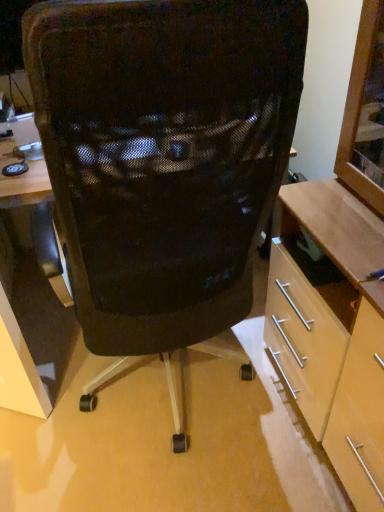
This screenshot has height=512, width=384. What do you see at coordinates (164, 157) in the screenshot?
I see `black mesh chair at center` at bounding box center [164, 157].

At what (x,y) coordinates should I click in order to perform the action: click on black mesh chair at center. Please return your answer as a coordinate pair (x, y). This screenshot has height=512, width=384. Looking at the image, I should click on (164, 157).

The image size is (384, 512). What do you see at coordinates (338, 287) in the screenshot?
I see `light wood cabinet at right` at bounding box center [338, 287].

Where is `light wood cabinet at right`? The width and height of the screenshot is (384, 512). light wood cabinet at right is located at coordinates point(338,287).

Find the location of a particular element. The image size is (384, 512). black mesh chair at center is located at coordinates (164, 157).

Is light wood cabinet at right at the left side of black mesh chair at center?

No, light wood cabinet at right is not to the left of black mesh chair at center.

Looking at this image, is the position of light wood cabinet at right more distant than that of black mesh chair at center?

No, it is not.

Is point (379, 250) less distant than point (55, 102)?

No, (379, 250) is behind (55, 102).

From the image's perspective, is light wood cabinet at right on black mesh chair at center?

Incorrect, from the image's perspective, light wood cabinet at right is lower than black mesh chair at center.

From a real-world perspective, between light wood cabinet at right and black mesh chair at center, who is vertically higher?

light wood cabinet at right, from a real-world perspective.

Considering the sizes of objects light wood cabinet at right and black mesh chair at center in the image provided, who is wider, light wood cabinet at right or black mesh chair at center?

black mesh chair at center.

Which of these two, light wood cabinet at right or black mesh chair at center, stands shorter?

light wood cabinet at right is shorter.

Based on the photo, does light wood cabinet at right have a larger size compared to black mesh chair at center?

Incorrect, light wood cabinet at right is not larger than black mesh chair at center.

Is black mesh chair at center located within light wood cabinet at right?

No, light wood cabinet at right does not contain black mesh chair at center.

Is light wood cabinet at right next to black mesh chair at center and touching it?

light wood cabinet at right and black mesh chair at center are clearly separated.

Is light wood cabinet at right looking in the opposite direction of black mesh chair at center?

No, black mesh chair at center is not at the back of light wood cabinet at right.

How many degrees apart are the facing directions of light wood cabinet at right and black mesh chair at center?

89.3 degrees.

Locate an element on the screen. This screenshot has width=384, height=512. chair on the left of the light wood cabinet at right is located at coordinates (164, 157).

Does black mesh chair at center appear on the left side of light wood cabinet at right?

Correct, you'll find black mesh chair at center to the left of light wood cabinet at right.

From the picture: Is black mesh chair at center in front of or behind light wood cabinet at right in the image?

black mesh chair at center is behind light wood cabinet at right.

Does point (201, 323) come farther from viewer compared to point (377, 38)?

Yes, it is behind point (377, 38).

From the image's perspective, does black mesh chair at center appear higher than light wood cabinet at right?

Correct, black mesh chair at center appears higher than light wood cabinet at right in the image.

From a real-world perspective, is black mesh chair at center below light wood cabinet at right?

Yes, from a real-world perspective, black mesh chair at center is beneath light wood cabinet at right.

Considering the sizes of objects black mesh chair at center and light wood cabinet at right in the image provided, who is wider, black mesh chair at center or light wood cabinet at right?

With larger width is black mesh chair at center.

Considering the sizes of objects black mesh chair at center and light wood cabinet at right in the image provided, who is shorter, black mesh chair at center or light wood cabinet at right?

With less height is light wood cabinet at right.

Is black mesh chair at center bigger or smaller than light wood cabinet at right?

black mesh chair at center is bigger than light wood cabinet at right.

Based on the photo, is black mesh chair at center spatially inside light wood cabinet at right, or outside of it?

black mesh chair at center cannot be found inside light wood cabinet at right.

Is black mesh chair at center next to light wood cabinet at right?

black mesh chair at center is not next to light wood cabinet at right, and they're not touching.

Could you tell me if black mesh chair at center is facing light wood cabinet at right?

No, black mesh chair at center is not turned towards light wood cabinet at right.

Can you tell me how much black mesh chair at center and light wood cabinet at right differ in facing direction?

The angle between the facing direction of black mesh chair at center and the facing direction of light wood cabinet at right is 89.3 degrees.

Locate an element on the screen. chair on the left of light wood cabinet at right is located at coordinates (164, 157).

This screenshot has height=512, width=384. I want to click on chair that is above the light wood cabinet at right (from the image's perspective), so click(x=164, y=157).

Where is `cabinetry in front of the black mesh chair at center`? This screenshot has height=512, width=384. cabinetry in front of the black mesh chair at center is located at coordinates (338, 287).